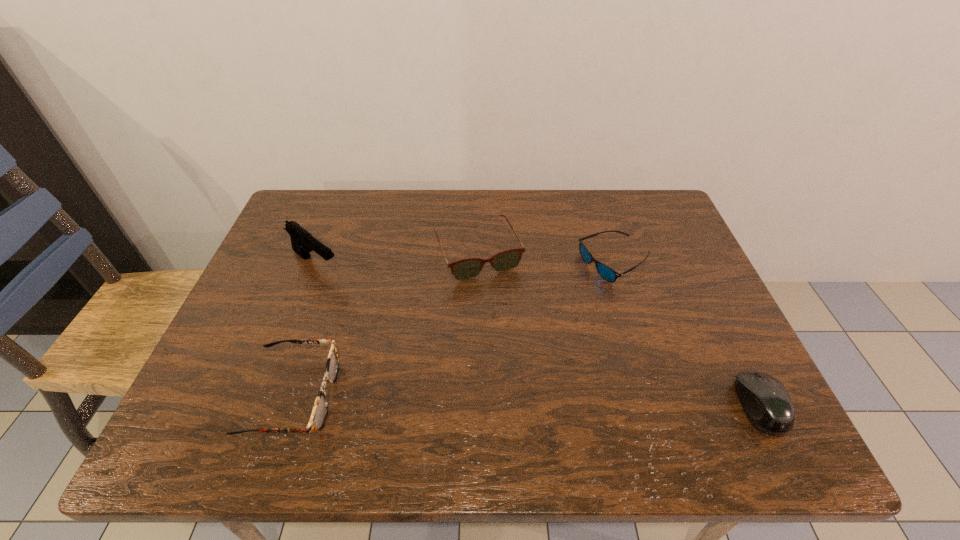
This screenshot has width=960, height=540. In order to click on mouse that is at the near edge in this screenshot , I will do `click(767, 404)`.

The width and height of the screenshot is (960, 540). Find the location of `spectacles that is positioned at the left edge`. spectacles that is positioned at the left edge is located at coordinates (320, 409).

What are the coordinates of `pistol that is at the left edge` in the screenshot? It's located at (302, 241).

Locate an element on the screen. This screenshot has height=540, width=960. mouse present at the right edge is located at coordinates (767, 404).

You are a GUI agent. You are given a task and a screenshot of the screen. Output one action in this format:
    pyautogui.click(x=<x>, y=<y>)
    Task: Click on the sunglasses positioned at the right edge
    Image resolution: width=960 pixels, height=540 pixels.
    Given the screenshot: What is the action you would take?
    pyautogui.click(x=607, y=273)

The width and height of the screenshot is (960, 540). I want to click on object situated at the near left corner, so click(320, 409).

Identify the location of object present at the near right corner. The height and width of the screenshot is (540, 960). (767, 404).

This screenshot has height=540, width=960. Find the location of `vacant space at the far edge`. vacant space at the far edge is located at coordinates (536, 204).

Locate an element on the screen. vacant space at the near edge is located at coordinates (416, 382).

Where is `blank space at the left edge`? blank space at the left edge is located at coordinates (263, 310).